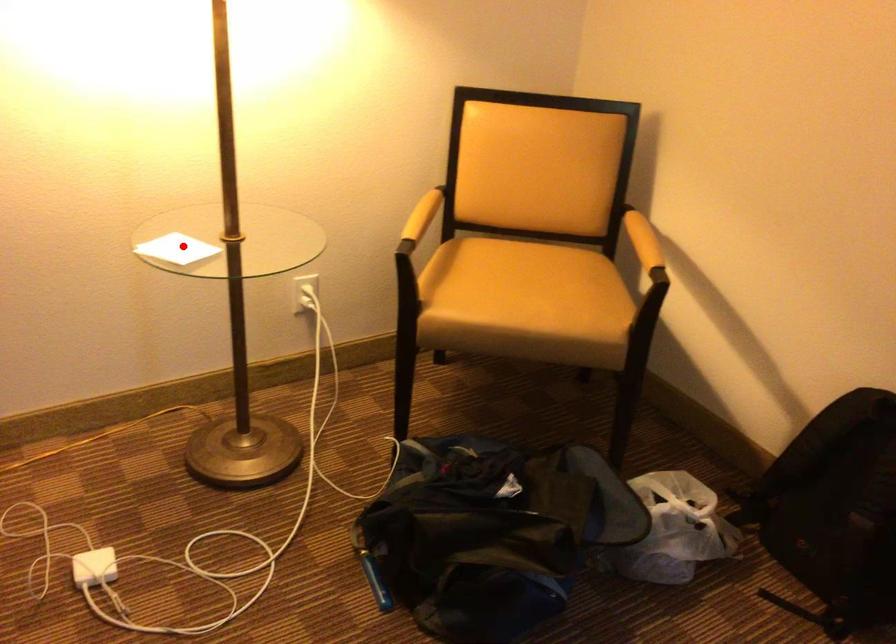
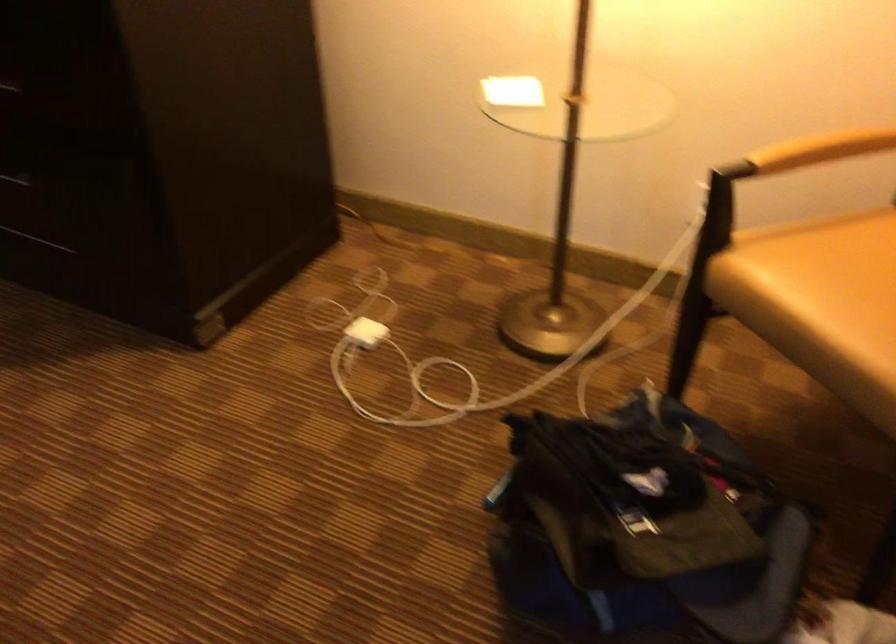
Find the pixel in the second image that matches the highlighted location in the first image.

(513, 91)